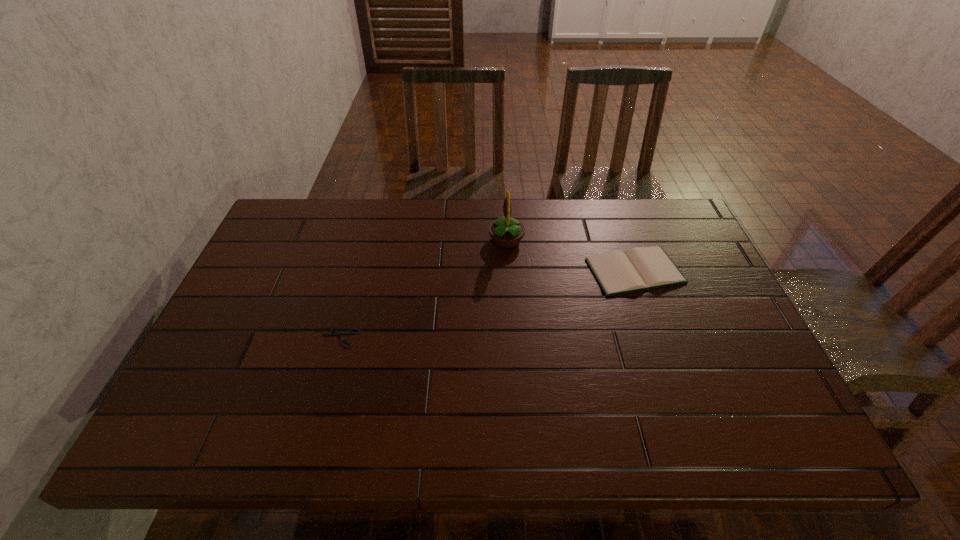
At what (x,y) coordinates should I click in order to perform the action: click on free space between the shortest object and the sunflower. Please return your answer as a coordinate pair (x, y). Looking at the image, I should click on (423, 288).

The width and height of the screenshot is (960, 540). I want to click on free point between the shears and the sunflower, so click(423, 288).

Where is `free area in between the hardback book and the leftmost object`? free area in between the hardback book and the leftmost object is located at coordinates (488, 304).

At what (x,y) coordinates should I click in order to perform the action: click on free spot between the leftmost object and the second shortest object. Please return your answer as a coordinate pair (x, y). Looking at the image, I should click on pos(488,304).

You are a GUI agent. You are given a task and a screenshot of the screen. Output one action in this format:
    pyautogui.click(x=<x>, y=<y>)
    Task: Click on the vacant area between the second shortest object and the sunflower
    Image resolution: width=960 pixels, height=540 pixels.
    Given the screenshot: What is the action you would take?
    pyautogui.click(x=570, y=255)

At what (x,y) coordinates should I click in order to perform the action: click on empty space between the shears and the second tallest object. Please return your answer as a coordinate pair (x, y). Looking at the image, I should click on (488, 304).

Find the location of a particular element. free point between the tallest object and the leftmost object is located at coordinates [423, 288].

Image resolution: width=960 pixels, height=540 pixels. Identify the location of free area in between the second tallest object and the sunflower. (570, 255).

Locate an element on the screen. object that is the second closest to the tallest object is located at coordinates (347, 332).

Locate an element on the screen. The width and height of the screenshot is (960, 540). the closest object to the nearest object is located at coordinates (506, 232).